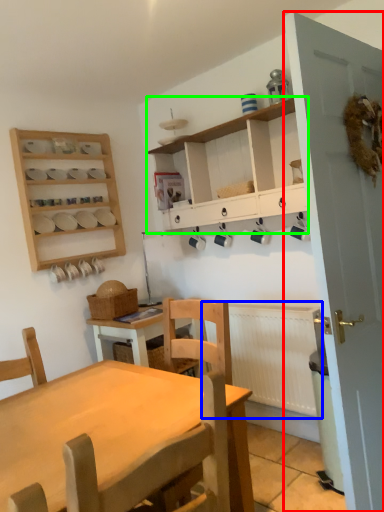
Question: Considering the real-world distances, which object is farthest from door (highlighted by a red box)? radiator (highlighted by a blue box) or cabinetry (highlighted by a green box)?

Choices:
 (A) radiator
 (B) cabinetry

Answer: (A)